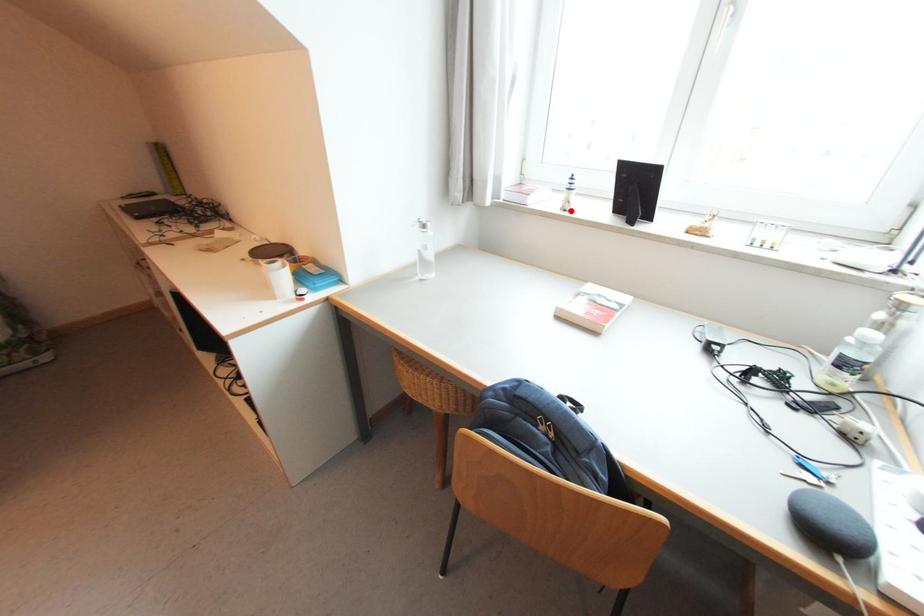
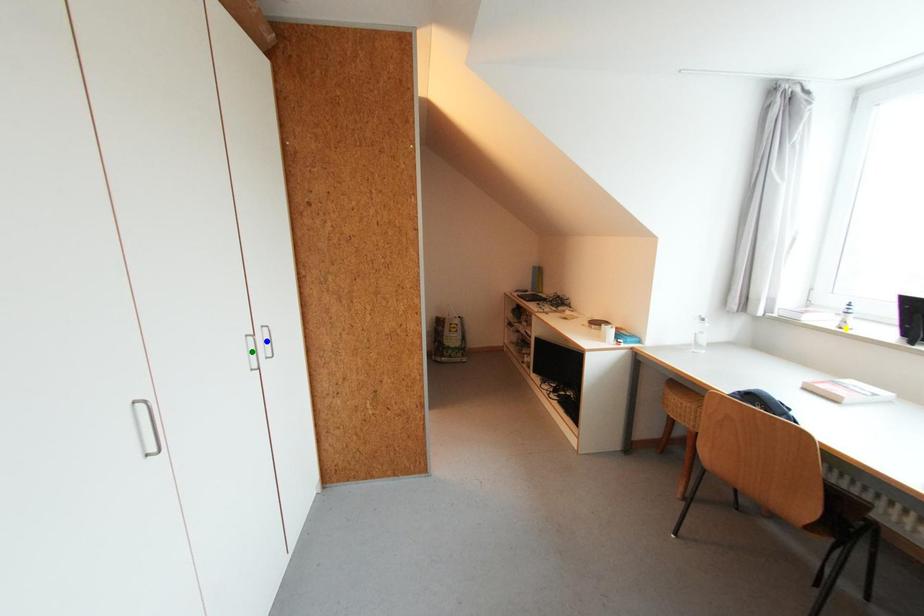
Question: I am providing you with two images of the same scene from different viewpoints. A red point is marked on the first image. You are given multiple points on the second image. Can you choose the point in image 2 that corresponds to the point in image 1?

Choices:
 (A) green point
 (B) yellow point
 (C) blue point

Answer: (B)